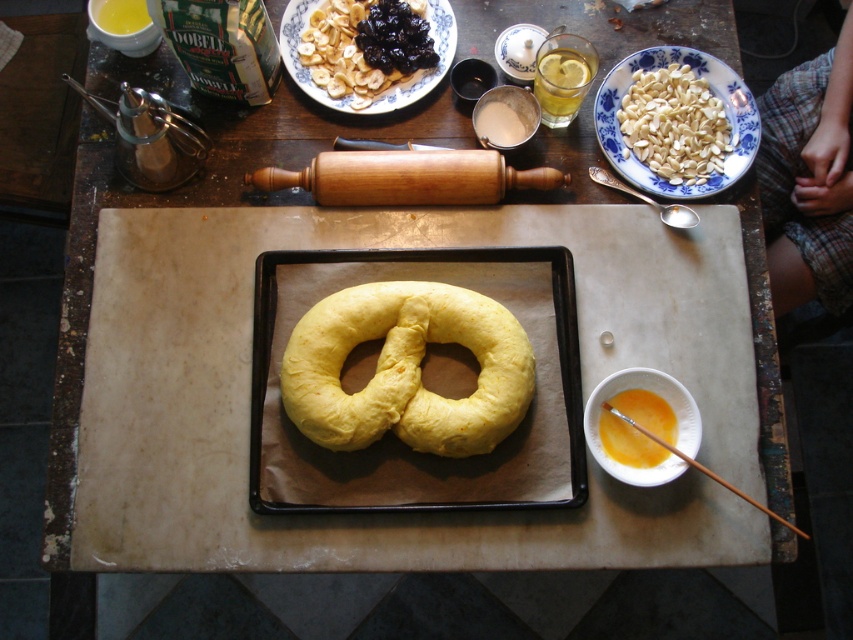
Question: Can you confirm if shiny brown nuts at center is wider than orange liquid at center?

Choices:
 (A) yes
 (B) no

Answer: (A)

Question: Which of these objects is positioned farthest from the yellow doughnut at center?

Choices:
 (A) shiny brown nuts at center
 (B) white smooth almonds at upper right

Answer: (B)

Question: Which of the following is the closest to the observer?

Choices:
 (A) white smooth almonds at upper right
 (B) orange liquid at center
 (C) yellow doughnut at center
 (D) shiny brown nuts at center

Answer: (C)

Question: Considering the relative positions of yellow doughnut at center and orange liquid at center in the image provided, where is yellow doughnut at center located with respect to orange liquid at center?

Choices:
 (A) below
 (B) above

Answer: (B)

Question: Which object appears farthest from the camera in this image?

Choices:
 (A) white smooth almonds at upper right
 (B) orange liquid at center
 (C) yellow doughnut at center

Answer: (A)

Question: Is yellow doughnut at center closer to camera compared to white smooth almonds at upper right?

Choices:
 (A) yes
 (B) no

Answer: (A)